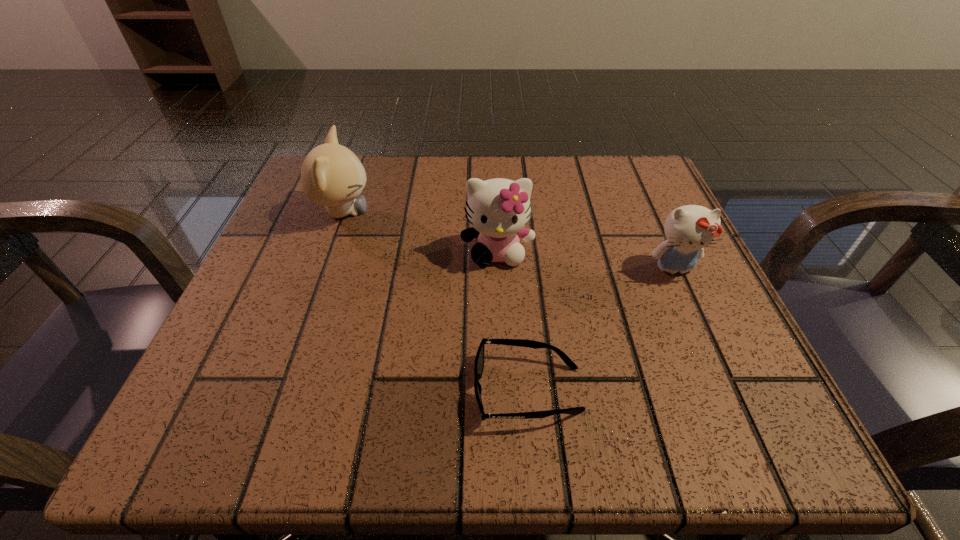
The height and width of the screenshot is (540, 960). Identify the location of the farthest object. (332, 175).

Find the location of a particular element. the farthest kitten is located at coordinates (332, 175).

The image size is (960, 540). I want to click on the second kitten from left to right, so click(498, 209).

Image resolution: width=960 pixels, height=540 pixels. In order to click on the rightmost kitten in this screenshot , I will do `click(688, 229)`.

The width and height of the screenshot is (960, 540). In order to click on the shortest kitten in this screenshot , I will do `click(688, 229)`.

Find the location of a particular element. The height and width of the screenshot is (540, 960). sunglasses is located at coordinates (479, 359).

Find the location of `the shortest object`. the shortest object is located at coordinates (479, 359).

I want to click on vacant space positioned 0.220m on the face of the farthest object, so click(x=486, y=212).

In order to click on free space located on the front-facing side of the second kitten from left to right in this screenshot , I will do `click(503, 387)`.

You are a GUI agent. You are given a task and a screenshot of the screen. Output one action in this format:
    pyautogui.click(x=<x>, y=<y>)
    Task: Click on the free space located on the front-facing side of the third tallest object
    The height and width of the screenshot is (540, 960).
    Given the screenshot: What is the action you would take?
    pyautogui.click(x=742, y=422)